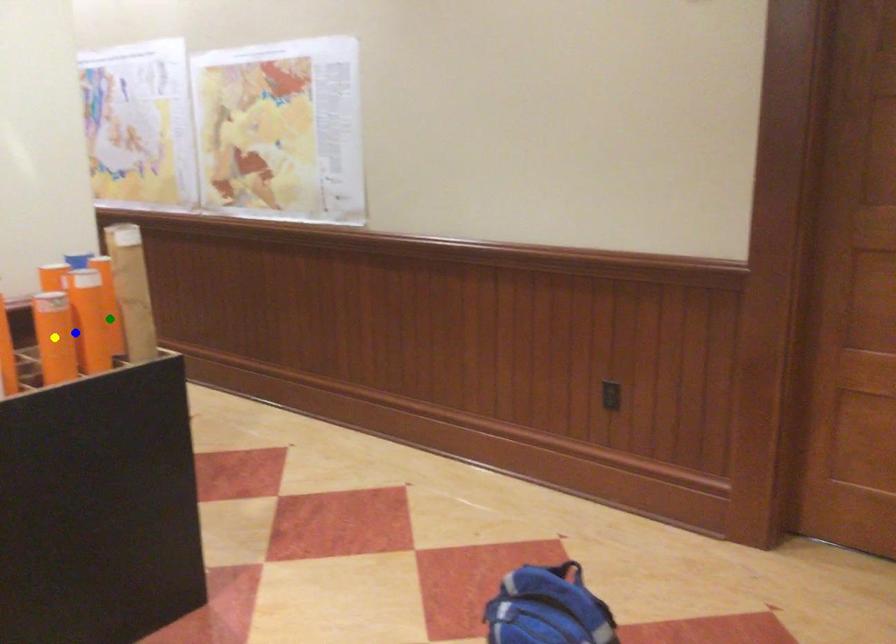
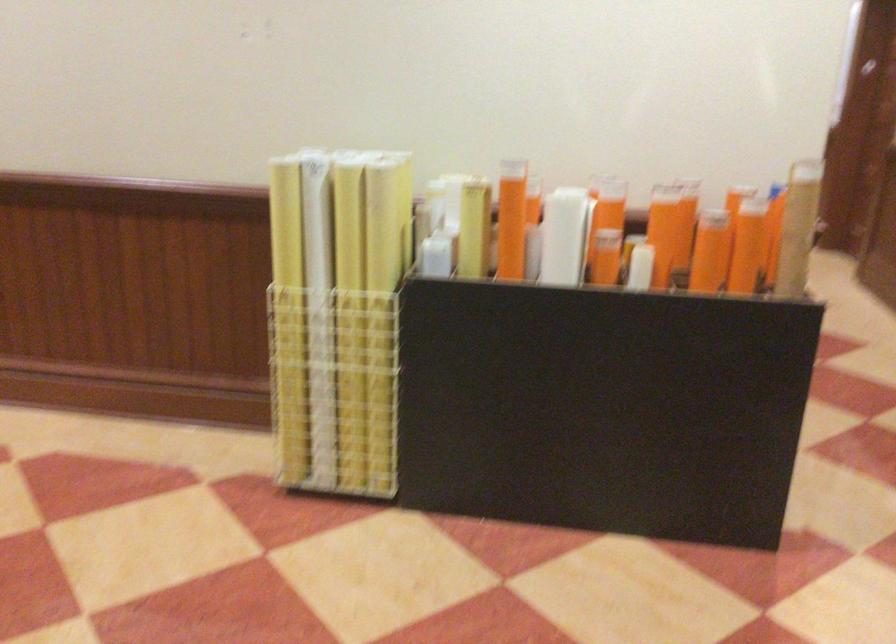
I am providing you with two images of the same scene from different viewpoints. Three points are marked in image1. Which point corresponds to a part or object that is occluded in image2?In image1, three points are marked. Which of them correspond to a part or object that is occluded in image2?Among the three points shown in image1, which one corresponds to a part or object that is no longer visible due to occlusion in image2?

yellow point cannot be seen in image2.